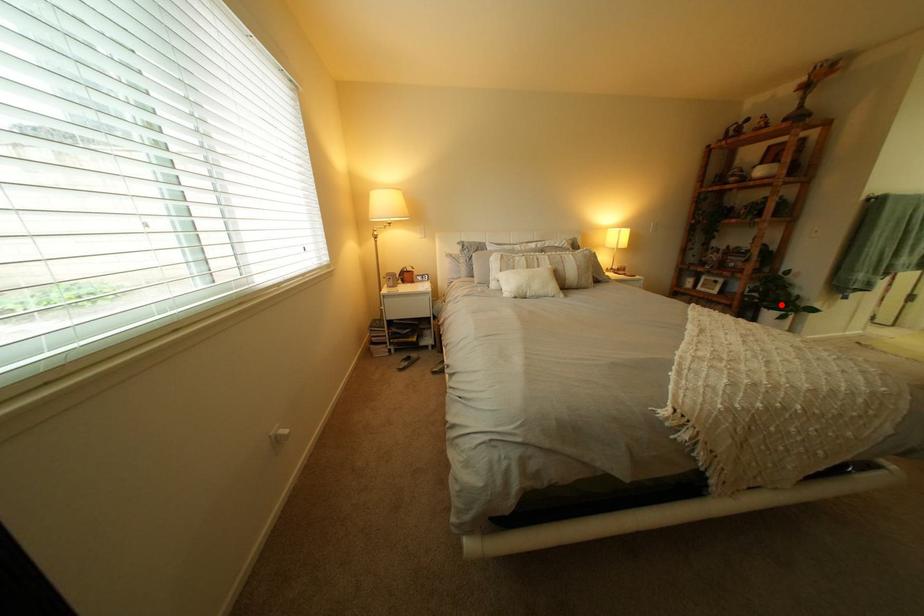
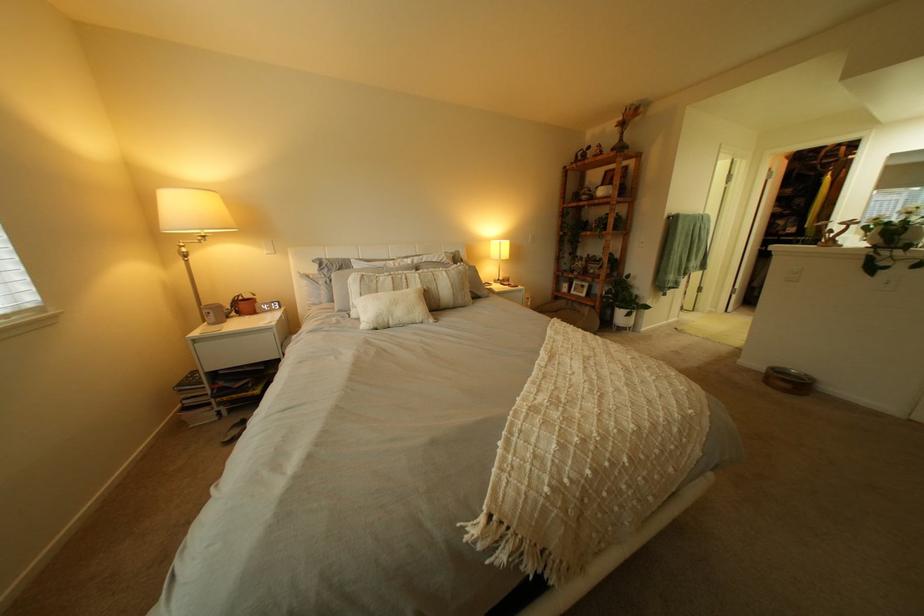
The point at the highlighted location is marked in the first image. Where is the corresponding point in the second image?

(633, 305)